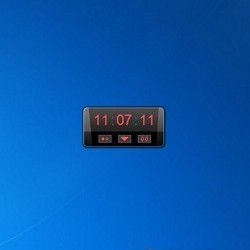
Locate an element on the screen. corner of clock is located at coordinates pos(85,107), pos(83,146), pos(163,145), pos(162,108).